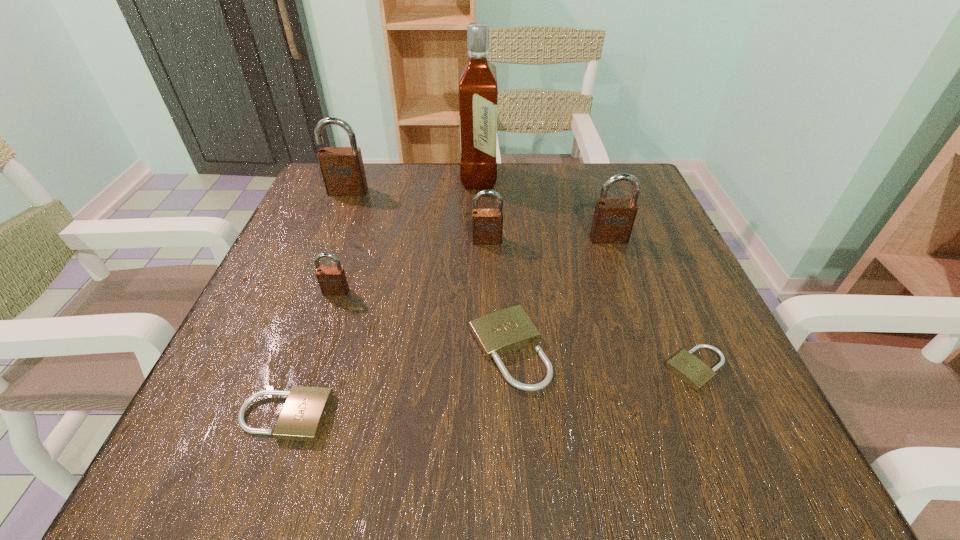
In order to click on liquor in this screenshot , I will do `click(478, 91)`.

I want to click on the biggest brown padlock, so click(342, 168).

You are a GUI agent. You are given a task and a screenshot of the screen. Output one action in this format:
    pyautogui.click(x=<x>, y=<y>)
    Task: Click on the farthest brown padlock
    Image resolution: width=960 pixels, height=540 pixels.
    Given the screenshot: What is the action you would take?
    pyautogui.click(x=342, y=168)

What are the coordinates of `the second tallest padlock` in the screenshot? It's located at (613, 220).

Where is `the third tallest object`? The image size is (960, 540). the third tallest object is located at coordinates (613, 220).

I want to click on the fifth shortest padlock, so click(x=487, y=224).

You are a GUI agent. You are given a task and a screenshot of the screen. Output one action in this format:
    pyautogui.click(x=<x>, y=<y>)
    Task: Click on the third biggest brown padlock
    This screenshot has height=540, width=960.
    Given the screenshot: What is the action you would take?
    pyautogui.click(x=487, y=224)

What are the coordinates of `the smallest brown padlock` in the screenshot? It's located at (332, 280).

At what (x,y) coordinates should I click in order to perform the action: click on the fourth shortest object. Please return your answer as a coordinate pair (x, y). This screenshot has height=540, width=960. Looking at the image, I should click on (332, 280).

I want to click on the third shortest padlock, so click(499, 333).